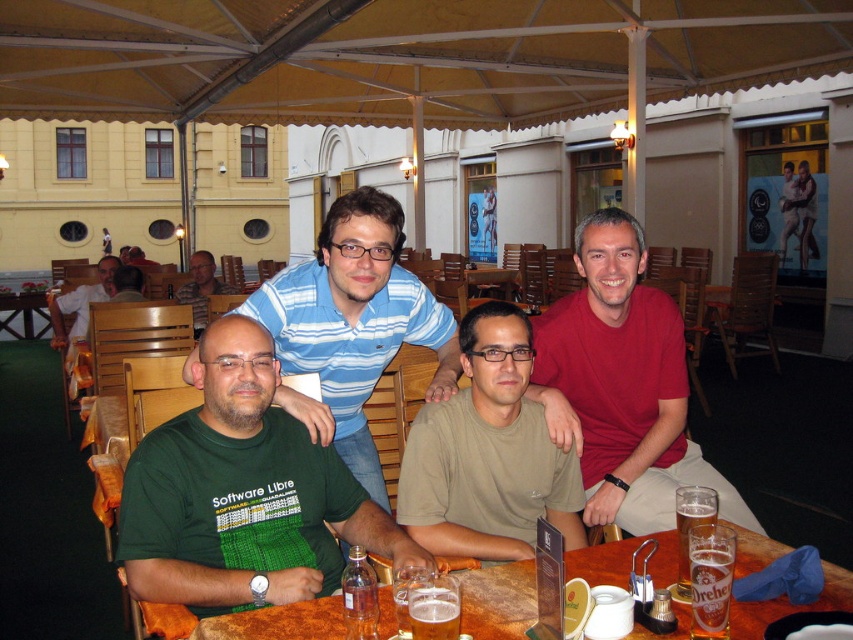
Question: Can you confirm if blue striped shirt at center is positioned to the right of matte blue shirt at center?

Choices:
 (A) yes
 (B) no

Answer: (A)

Question: Which of these objects is positioned closest to the green fabric shirt at center?

Choices:
 (A) matte green t-shirt at lower left
 (B) translucent glass beer at table center

Answer: (A)

Question: Which object appears farthest from the camera in this image?

Choices:
 (A) green jersey at center
 (B) blue striped shirt at center
 (C) green fabric shirt at center
 (D) translucent glass mug at table center

Answer: (C)

Question: Which point appears closest to the camera in this image?

Choices:
 (A) (689, 580)
 (B) (720, 608)
 (C) (134, 244)

Answer: (B)

Question: Is green cotton t-shirt at center bigger than translucent glass mug at table center?

Choices:
 (A) yes
 (B) no

Answer: (A)

Question: Is matte red shirt at center smaller than amber glass beer at table center?

Choices:
 (A) yes
 (B) no

Answer: (B)